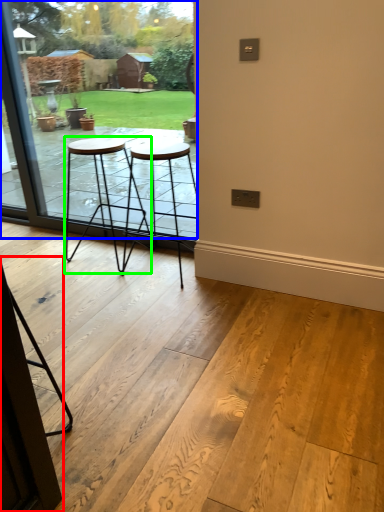
Question: Considering the real-world distances, which object is farthest from screen door (highlighted by a red box)? window (highlighted by a blue box) or stool (highlighted by a green box)?

Choices:
 (A) window
 (B) stool

Answer: (A)